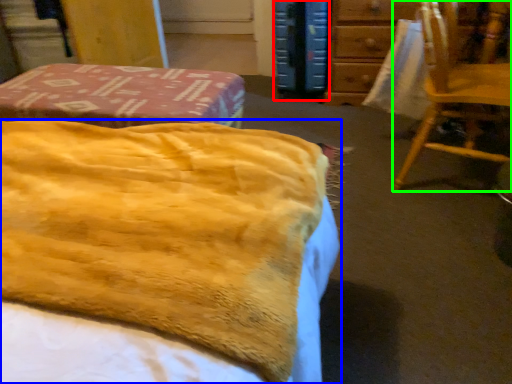
Question: Which is nearer to the paperback book (highlighted by a red box)? bed (highlighted by a blue box) or chair (highlighted by a green box).

Choices:
 (A) bed
 (B) chair

Answer: (B)